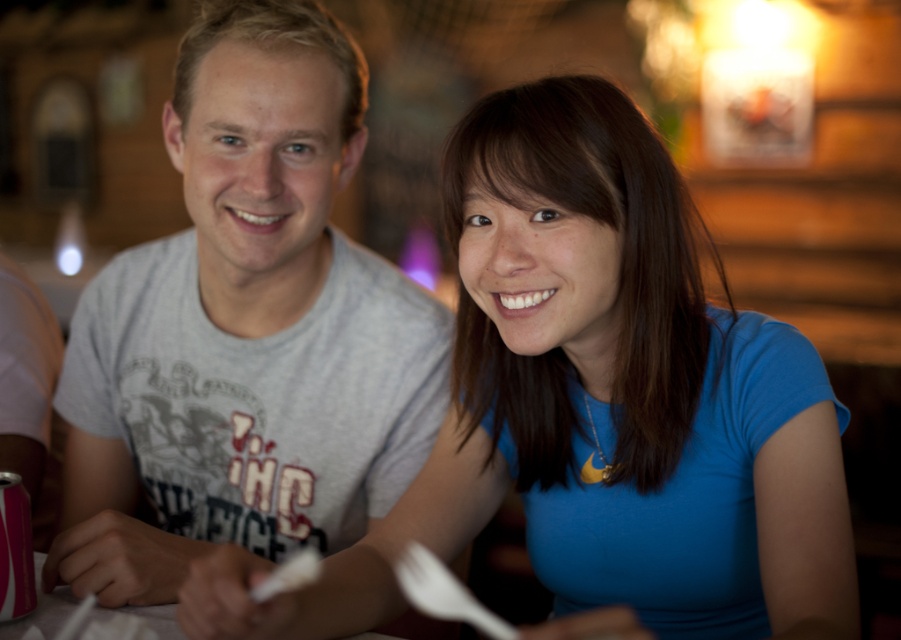
Question: Does blue matte shirt at center come behind gray cotton t-shirt at center?

Choices:
 (A) no
 (B) yes

Answer: (A)

Question: Considering the relative positions of blue matte shirt at center and gray cotton t-shirt at center in the image provided, where is blue matte shirt at center located with respect to gray cotton t-shirt at center?

Choices:
 (A) below
 (B) above

Answer: (A)

Question: Is blue matte shirt at center closer to camera compared to gray cotton t-shirt at center?

Choices:
 (A) no
 (B) yes

Answer: (B)

Question: Which point is farther from the camera taking this photo?

Choices:
 (A) (211, 129)
 (B) (360, 596)

Answer: (A)